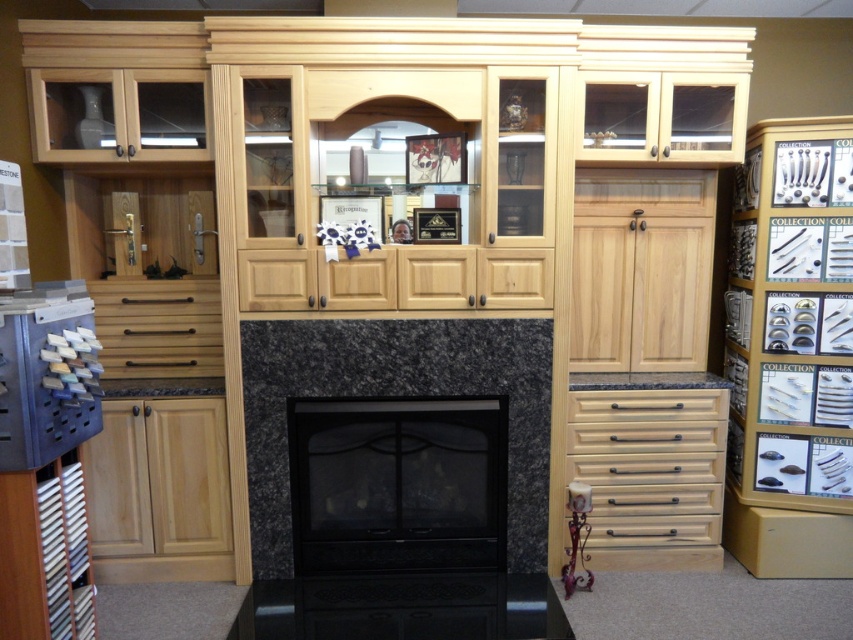
Who is lower down, natural wood cabinet at center or matte wood cabinet at lower left?

matte wood cabinet at lower left

Where is `natural wood cabinet at center`? natural wood cabinet at center is located at coordinates (641, 268).

Measure the distance between natural wood cabinet at center and matte wood drawer at center.

natural wood cabinet at center is 1.69 meters away from matte wood drawer at center.

Does natural wood cabinet at center have a greater width compared to matte wood drawer at center?

Yes.

Is point (605, 280) more distant than point (106, 339)?

Yes.

Where is `natural wood cabinet at center`? The image size is (853, 640). natural wood cabinet at center is located at coordinates (641, 268).

Is natural wood cabinet at lower left shorter than matte wood drawer at center?

Incorrect, natural wood cabinet at lower left's height does not fall short of matte wood drawer at center's.

Which is more to the right, natural wood cabinet at lower left or matte wood drawer at center?

natural wood cabinet at lower left is more to the right.

Consider the image. Measure the distance between point (138, 454) and camera.

Point (138, 454) is 2.94 meters away from camera.

At what (x,y) coordinates should I click in order to perform the action: click on natural wood cabinet at lower left. Please return your answer as a coordinate pair (x, y). Looking at the image, I should click on (160, 490).